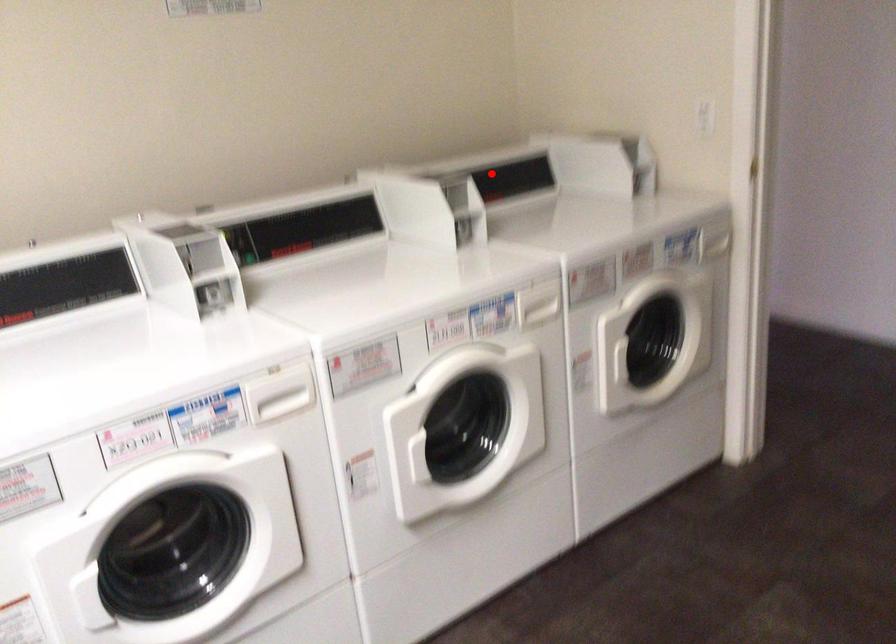
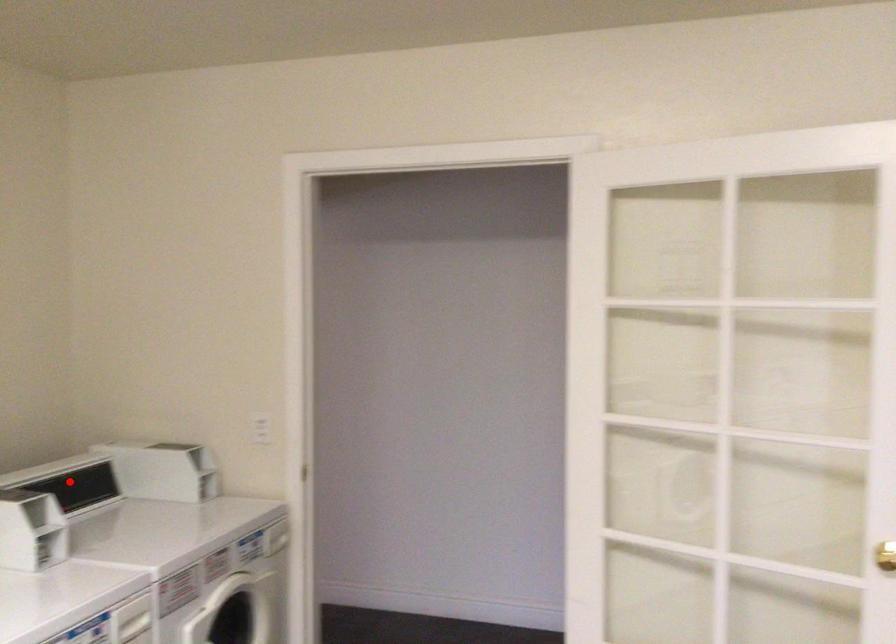
I am providing you with two images of the same scene from different viewpoints. A red point is marked on the first image and another point is marked on the second image. Is the red point in image1 aligned with the point shown in image2?

Yes